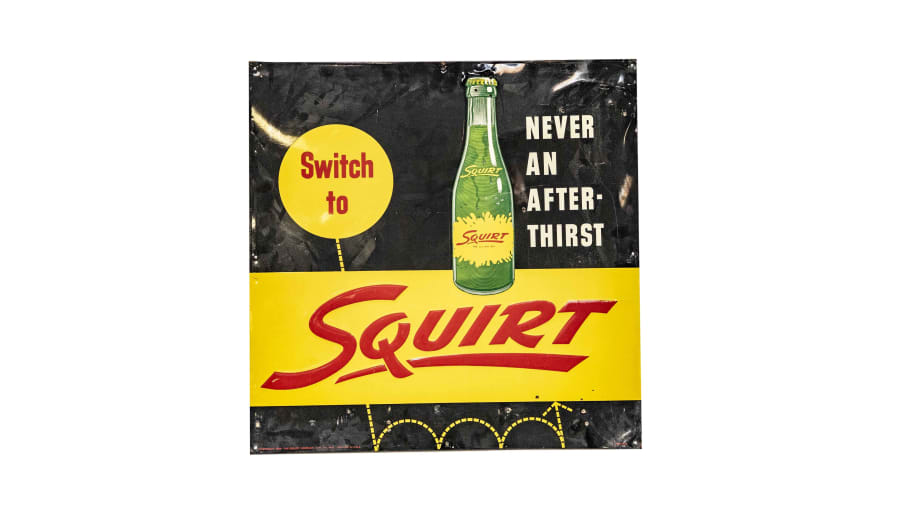
The width and height of the screenshot is (900, 506). What are the coordinates of `bottle` in the screenshot? It's located at (473, 203).